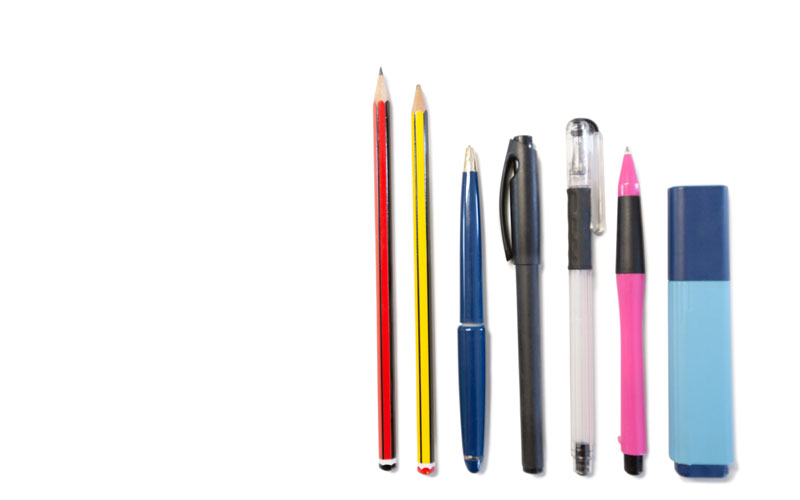
At what (x,y) coordinates should I click in order to perform the action: click on writing implements. Please return your answer as a coordinate pair (x, y). Looking at the image, I should click on (381, 404), (428, 424), (478, 414), (530, 402), (581, 407), (630, 351), (694, 357).